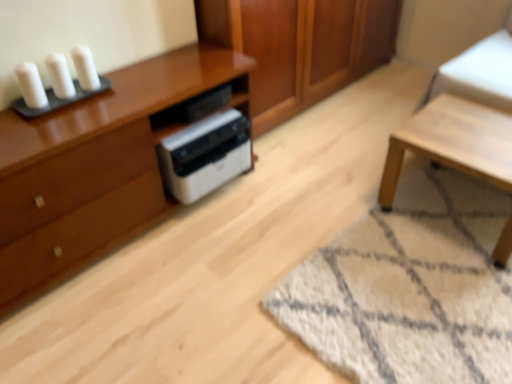
Question: Is wooden cabinet at center shorter than white plastic printer at center?

Choices:
 (A) no
 (B) yes

Answer: (A)

Question: From a real-world perspective, is wooden cabinet at center physically above white plastic printer at center?

Choices:
 (A) yes
 (B) no

Answer: (A)

Question: Is wooden cabinet at center oriented towards white plastic printer at center?

Choices:
 (A) yes
 (B) no

Answer: (B)

Question: Does wooden cabinet at center appear on the left side of white plastic printer at center?

Choices:
 (A) no
 (B) yes

Answer: (A)

Question: Is the depth of wooden cabinet at center greater than that of white plastic printer at center?

Choices:
 (A) yes
 (B) no

Answer: (A)

Question: Looking at the image, does light wood table at lower right seem bigger or smaller compared to white plastic printer at center?

Choices:
 (A) small
 (B) big

Answer: (B)

Question: Considering their positions, is light wood table at lower right located in front of or behind white plastic printer at center?

Choices:
 (A) behind
 (B) front

Answer: (B)

Question: From the image's perspective, is light wood table at lower right above or below white plastic printer at center?

Choices:
 (A) above
 (B) below

Answer: (B)

Question: Which is correct: light wood table at lower right is inside white plastic printer at center, or outside of it?

Choices:
 (A) inside
 (B) outside

Answer: (B)

Question: In terms of width, does white shaggy rug at lower right look wider or thinner when compared to wooden cabinet at center?

Choices:
 (A) wide
 (B) thin

Answer: (A)

Question: From the image's perspective, is white shaggy rug at lower right located above or below wooden cabinet at center?

Choices:
 (A) above
 (B) below

Answer: (B)

Question: In the image, is white shaggy rug at lower right on the left side or the right side of wooden cabinet at center?

Choices:
 (A) right
 (B) left

Answer: (A)

Question: In terms of height, does white shaggy rug at lower right look taller or shorter compared to wooden cabinet at center?

Choices:
 (A) short
 (B) tall

Answer: (A)

Question: From the image's perspective, is matte brown cabinet at left positioned above or below white matte candle at upper left, marked as the 1th candle in a right-to-left arrangement?

Choices:
 (A) below
 (B) above

Answer: (A)

Question: Would you say matte brown cabinet at left is inside or outside white matte candle at upper left, the third candle viewed from the left?

Choices:
 (A) inside
 (B) outside

Answer: (B)